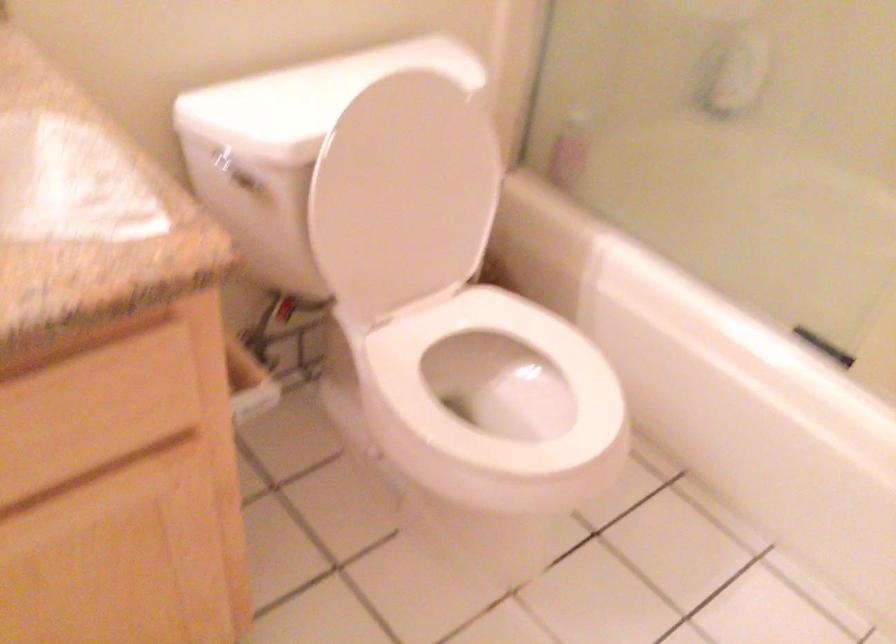
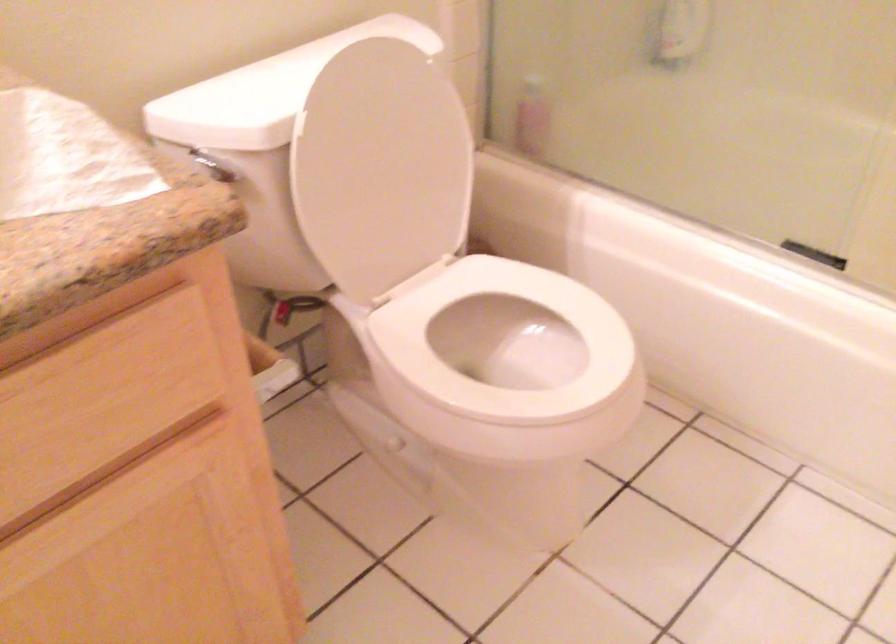
Find the pixel in the second image that matches point 402,190 in the first image.

(381, 167)